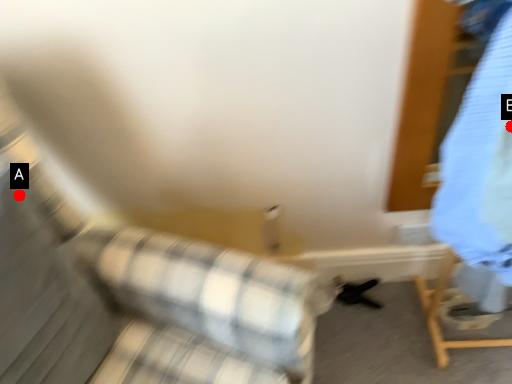
Question: Two points are circled on the image, labeled by A and B beside each circle. Which point is closer to the camera?

Choices:
 (A) A is closer
 (B) B is closer

Answer: (B)